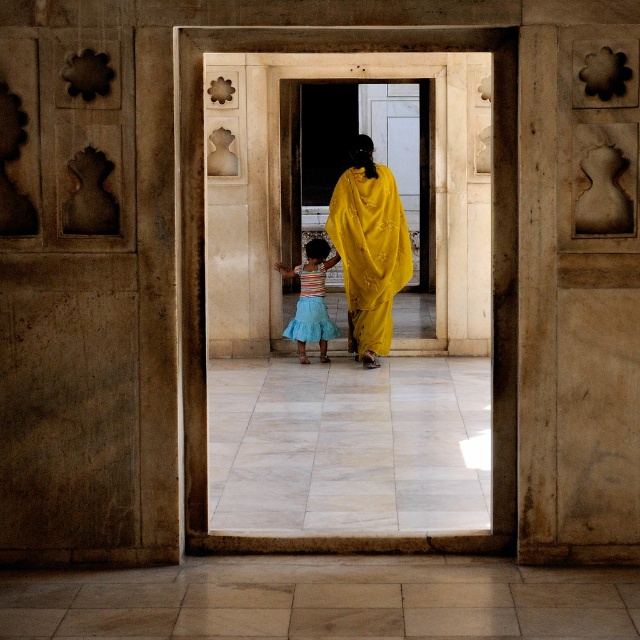
Can you confirm if yellow satin sari at center is bigger than blue tulle skirt at center?

Yes.

Who is more distant from viewer, (378, 205) or (298, 317)?

The point (298, 317) is more distant.

Is point (369, 228) behind point (330, 320)?

That is False.

At what (x,y) coordinates should I click in order to perform the action: click on yellow satin sari at center. Please return your answer as a coordinate pair (x, y). The height and width of the screenshot is (640, 640). Looking at the image, I should click on (369, 248).